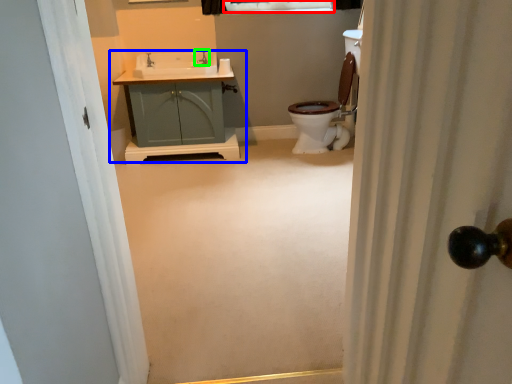
Question: Based on their relative distances, which object is farther from window (highlighted by a red box)? Choose from bathroom cabinet (highlighted by a blue box) and tap (highlighted by a green box).

Choices:
 (A) bathroom cabinet
 (B) tap

Answer: (A)